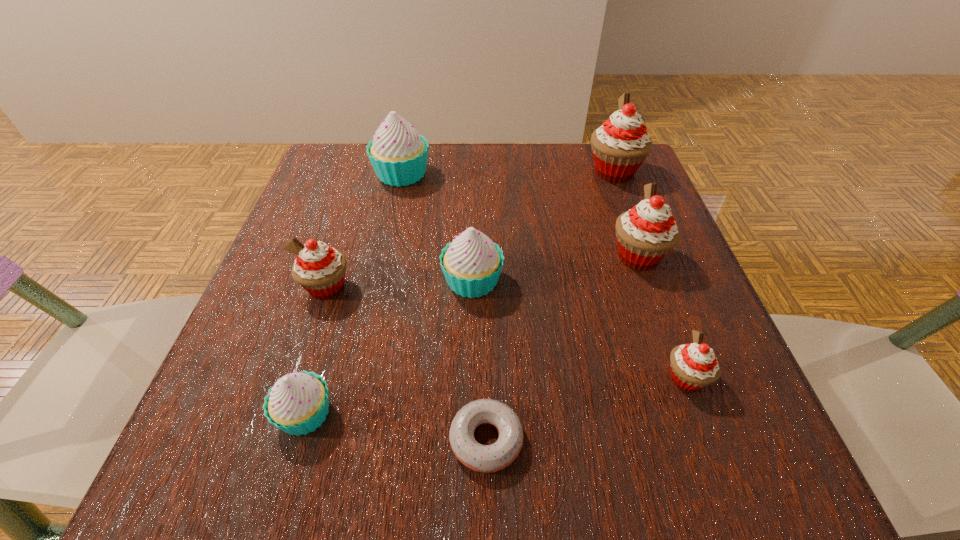
Locate an element on the screen. the tallest cupcake is located at coordinates (619, 147).

Locate an element on the screen. The width and height of the screenshot is (960, 540). the tallest object is located at coordinates (619, 147).

Find the location of a particular element. Image resolution: width=960 pixels, height=540 pixels. the biggest white cupcake is located at coordinates (398, 154).

Identify the location of the third smallest pink cupcake. This screenshot has height=540, width=960. (645, 234).

The width and height of the screenshot is (960, 540). In order to click on the second farthest white cupcake in this screenshot , I will do `click(472, 263)`.

Where is `the fourth cupcake from right to left`? the fourth cupcake from right to left is located at coordinates (472, 263).

Locate an element on the screen. The height and width of the screenshot is (540, 960). the third biggest pink cupcake is located at coordinates (320, 269).

You are a GUI agent. You are given a task and a screenshot of the screen. Output one action in this format:
    pyautogui.click(x=<x>, y=<y>)
    Task: Click on the nearest pink cupcake
    
    Given the screenshot: What is the action you would take?
    pyautogui.click(x=693, y=366)

Find the location of a particular element. the nearest white cupcake is located at coordinates (298, 403).

Locate an element on the screen. doughnut is located at coordinates (482, 458).